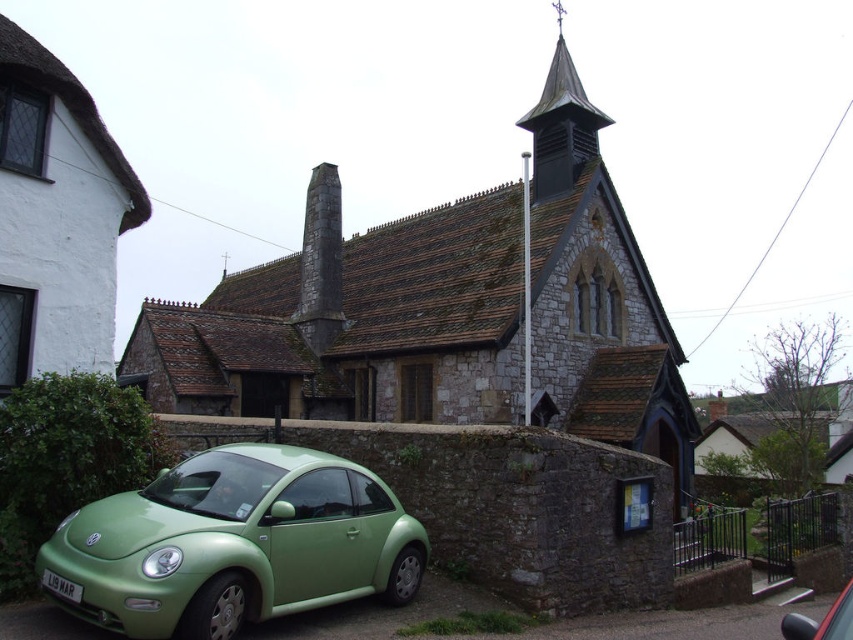
You are standing at the point closest to the church. Which coordinate point, point (265, 316) or point (846, 616), is farther away from you?

Point (265, 316) is behind point (846, 616), so the point farther away from you is point (265, 316).

You are a pedestrian standing in front of the church and want to walk to the flagpole. There are two cars, a matte green car at lower left and a green matte car at lower left, blocking your path. Which car should you move to the side to get to the flagpole?

The matte green car at lower left is to the left of green matte car at lower left, so you should move the green matte car at lower left which is on the right side to access the flagpole.